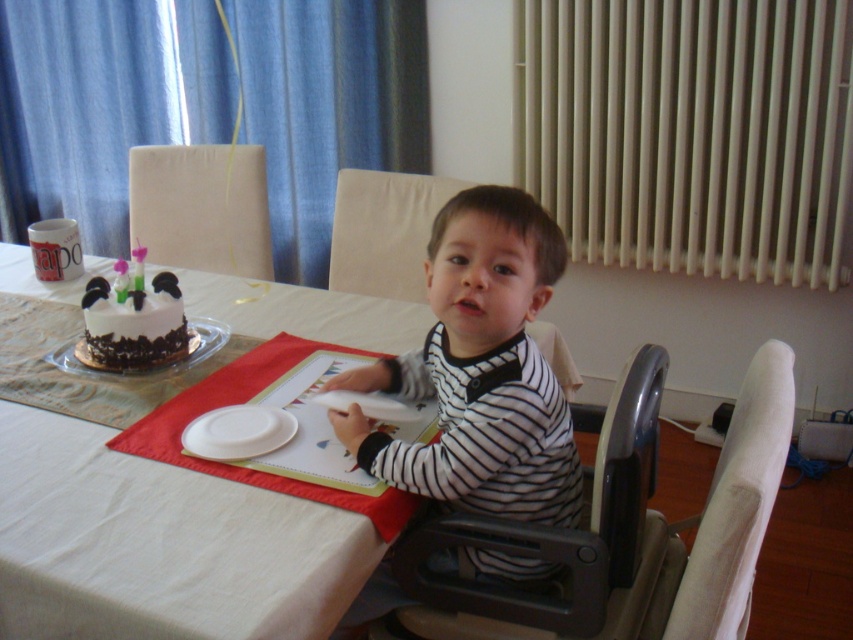
You are a parent trying to ensure your child is seated safely. The white cloth table at center and the striped fabric shirt at center are both in the image. Based on the distance between them, can you confirm if the shirt is within a safe proximity to the table to prevent spills?

The white cloth table at center is 12.84 inches away from striped fabric shirt at center. Since the distance is more than the typical 6 inches recommended for safe spill prevention, the shirt is within a safe proximity.

Consider the image. You are a photographer setting up for a birthday photo. You need to ensure that the white cloth table at center and the striped fabric shirt at center are both visible in the frame. Given their sizes, which object should you focus on to ensure both are in the shot?

The white cloth table at center occupies less space than striped fabric shirt at center, so you should focus on the striped fabric shirt at center to ensure both are visible in the frame.